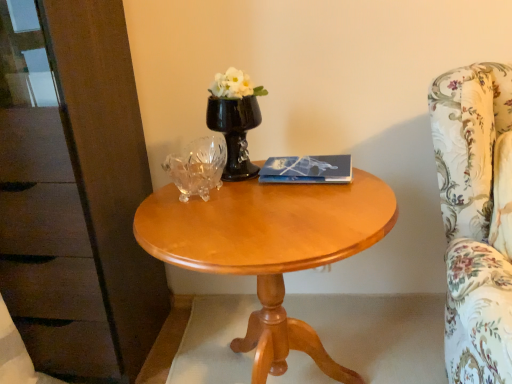
I want to click on blank space situated above blue glossy book at center (from a real-world perspective), so click(302, 160).